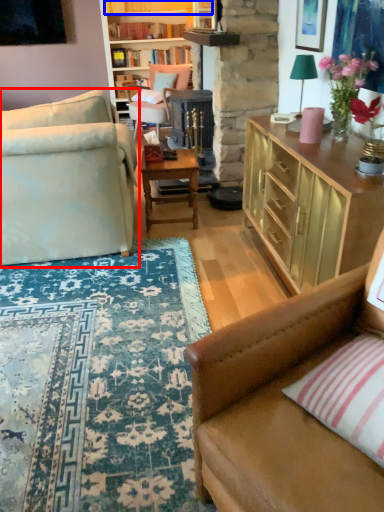
Question: Which object is further to the camera taking this photo, studio couch (highlighted by a red box) or book (highlighted by a blue box)?

Choices:
 (A) studio couch
 (B) book

Answer: (B)